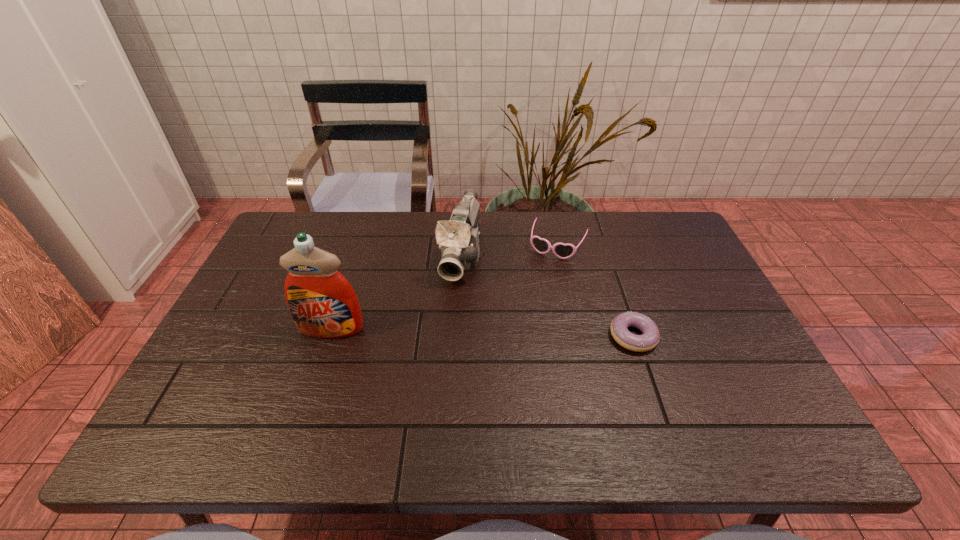
Select which object is the second closest to the sunglasses. Please provide its 2D coordinates. Your answer should be formatted as a tuple, i.e. [(x, y)], where the tuple contains the x and y coordinates of a point satisfying the conditions above.

[(649, 339)]

Locate which object is the third closest to the tallest object. Please provide its 2D coordinates. Your answer should be formatted as a tuple, i.e. [(x, y)], where the tuple contains the x and y coordinates of a point satisfying the conditions above.

[(649, 339)]

Locate an element on the screen. The height and width of the screenshot is (540, 960). blank area in the image that satisfies the following two spatial constraints: 1. on the front surface of the shortest object; 2. on the right side of the tallest object is located at coordinates (329, 336).

Locate an element on the screen. This screenshot has height=540, width=960. vacant region that satisfies the following two spatial constraints: 1. on the front surface of the shortest object; 2. on the left side of the leftmost object is located at coordinates (329, 336).

Locate an element on the screen. The image size is (960, 540). vacant space that satisfies the following two spatial constraints: 1. on the front surface of the doughnut; 2. on the right side of the tallest object is located at coordinates (329, 336).